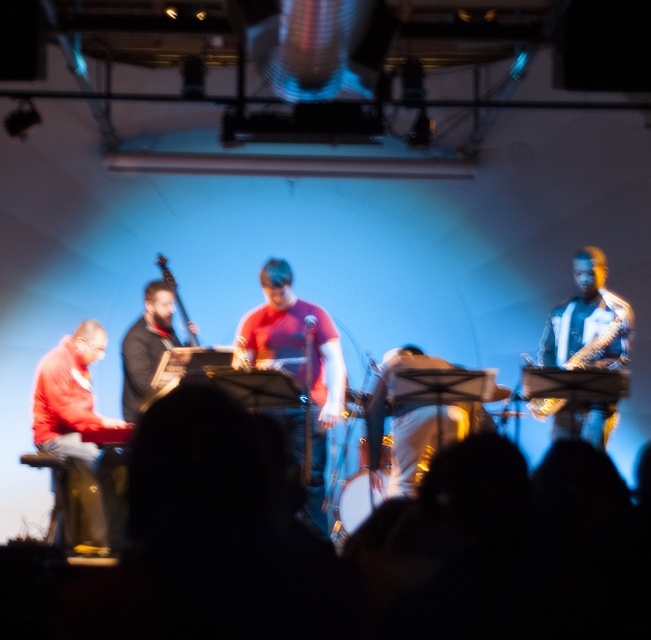
Is point (316, 314) closer to camera compared to point (163, 291)?

Yes, point (316, 314) is in front of point (163, 291).

Measure the distance between point (311,394) and camera.

Point (311,394) is 5.06 meters from camera.

Who is more distant from viewer, (316, 486) or (154, 304)?

The point (154, 304) is more distant.

Where is `matte red shirt at center`? matte red shirt at center is located at coordinates (298, 369).

Does red matte jacket at left appear on the left side of matte red shirt at center?

Yes, red matte jacket at left is to the left of matte red shirt at center.

Which of these two, red matte jacket at left or matte red shirt at center, stands shorter?

red matte jacket at left is shorter.

Which is behind, point (117, 476) or point (258, 332)?

The point (258, 332) is behind.

The image size is (651, 640). Find the location of `red matte jacket at left`. red matte jacket at left is located at coordinates (77, 440).

From the picture: Measure the distance from shiny silver jacket at right to matte black bass at center.

shiny silver jacket at right and matte black bass at center are 2.50 meters apart from each other.

Which is in front, point (607, 364) or point (154, 301)?

Point (607, 364) is in front.

Find the location of a particular element. The image size is (651, 640). shiny silver jacket at right is located at coordinates (587, 321).

This screenshot has width=651, height=640. In order to click on shiny silver jacket at right in this screenshot , I will do `click(587, 321)`.